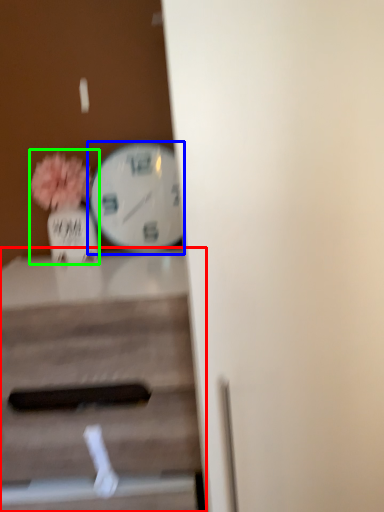
Question: Considering the real-world distances, which object is closest to table (highlighted by a red box)? wall clock (highlighted by a blue box) or floral arrangement (highlighted by a green box).

Choices:
 (A) wall clock
 (B) floral arrangement

Answer: (B)